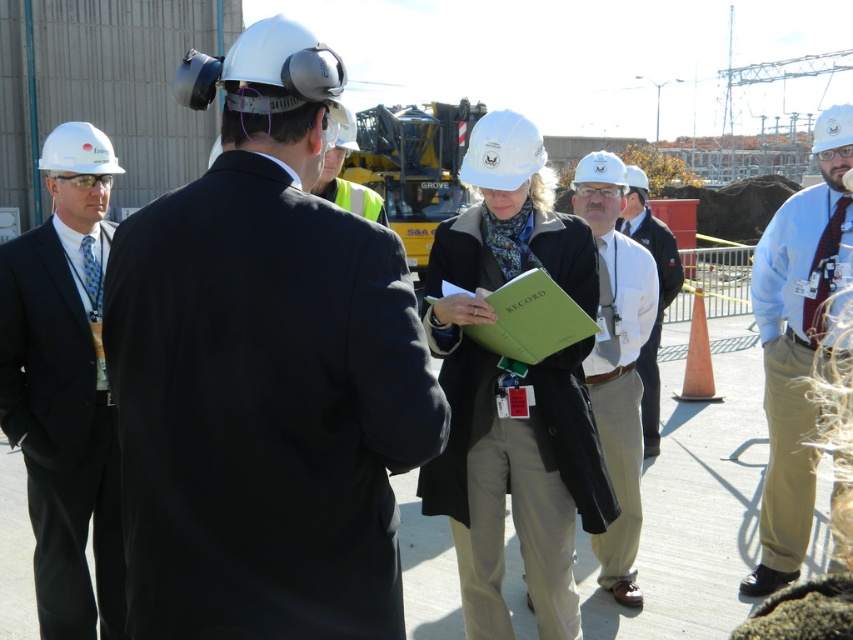
You are a security guard at the construction site. You need to identify which of the two individuals wearing matte black clothing is closer to you. Both are at the center of the image. The two objects are matte black suit at center and matte black jacket at center. Which one is shorter?

The matte black suit at center is shorter than the matte black jacket at center, so the individual wearing the matte black suit at center is closer to you.

You are standing at the construction site and need to determine which of the two points, point (164,509) or point (602,566), is closer to you. Which one should you choose?

Point (164,509) is closer to the viewer than point (602,566), so you should choose point (164,509).

You are standing at the center of the construction site and see the point marked at coordinates (x=798, y=342). What is the clothing description of the person located at that point?

The person at point (x=798, y=342) is wearing a light blue shirt with a tie.